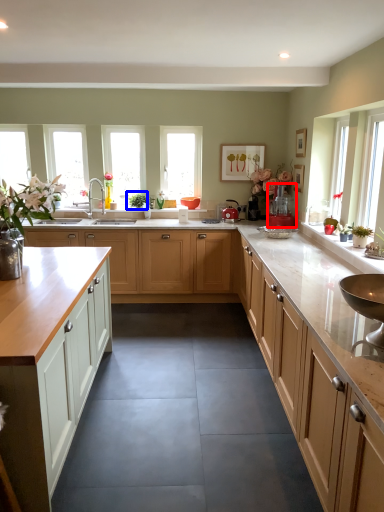
Question: Which point is closer to the camera, appliance (highlighted by a red box) or plant (highlighted by a blue box)?

Choices:
 (A) appliance
 (B) plant

Answer: (A)